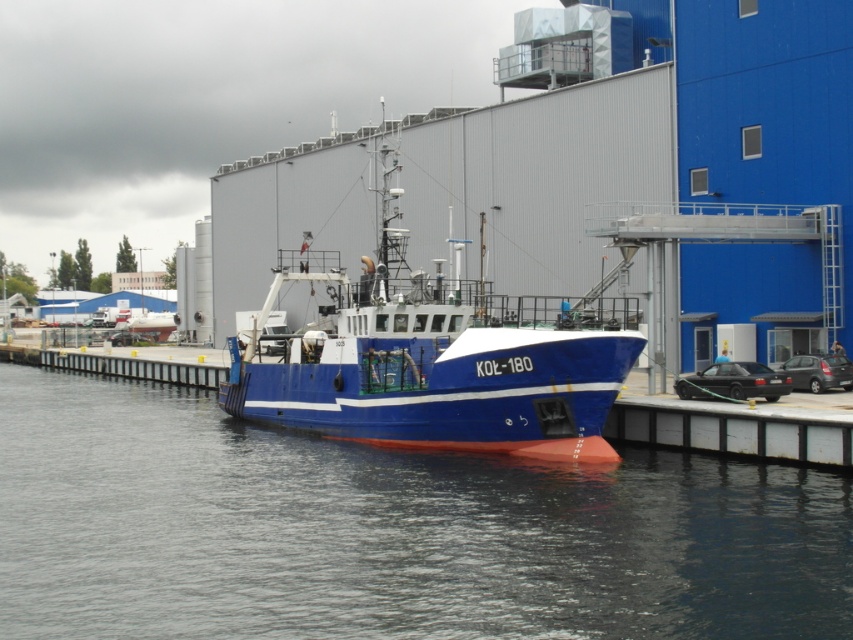
Who is positioned more to the right, blue glossy water at center or blue matte boat at center?

From the viewer's perspective, blue glossy water at center appears more on the right side.

Who is shorter, blue glossy water at center or blue matte boat at center?

Standing shorter between the two is blue glossy water at center.

Is point (642, 500) positioned before point (325, 289)?

Yes.

You are a GUI agent. You are given a task and a screenshot of the screen. Output one action in this format:
    pyautogui.click(x=<x>, y=<y>)
    Task: Click on the blue glossy water at center
    
    Given the screenshot: What is the action you would take?
    pyautogui.click(x=387, y=532)